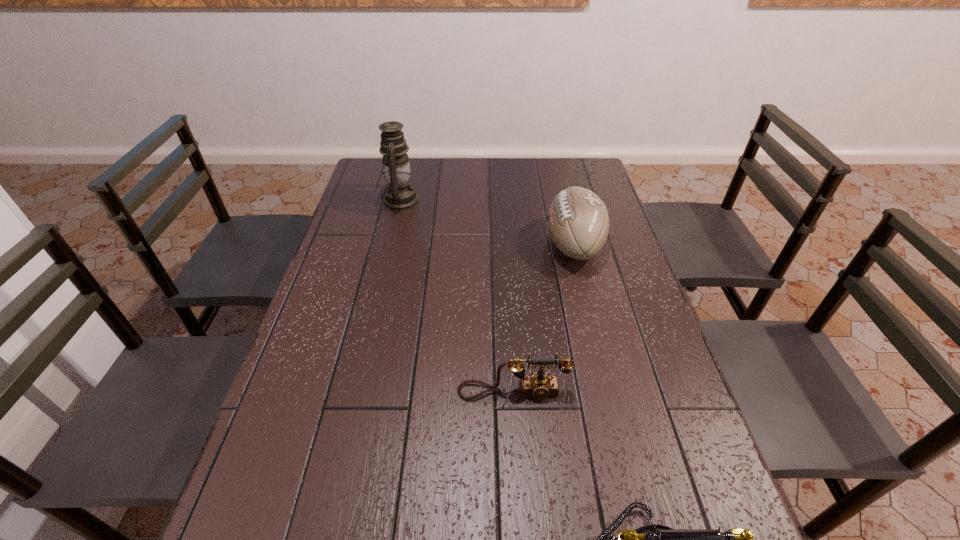
Where is `object that is at the far edge`? Image resolution: width=960 pixels, height=540 pixels. object that is at the far edge is located at coordinates (400, 195).

This screenshot has width=960, height=540. What are the coordinates of `object present at the left edge` in the screenshot? It's located at (400, 195).

Where is `object that is at the right edge`? object that is at the right edge is located at coordinates (578, 222).

The image size is (960, 540). Find the location of `object located at the far left corner`. object located at the far left corner is located at coordinates (400, 195).

Find the location of a particular element. The height and width of the screenshot is (540, 960). free space at the far edge of the desktop is located at coordinates (428, 160).

Where is `free location at the left edge`? This screenshot has width=960, height=540. free location at the left edge is located at coordinates (334, 423).

At what (x,y) coordinates should I click in order to perform the action: click on vacant space at the right edge. Please return your answer as a coordinate pair (x, y). Looking at the image, I should click on (616, 254).

Image resolution: width=960 pixels, height=540 pixels. Identify the location of vacant space at the far left corner. (388, 183).

Where is `vacant space at the far right corner of the desktop`? vacant space at the far right corner of the desktop is located at coordinates (577, 173).

Where is `vacant region between the tallest object and the football (American)`? The width and height of the screenshot is (960, 540). vacant region between the tallest object and the football (American) is located at coordinates (487, 223).